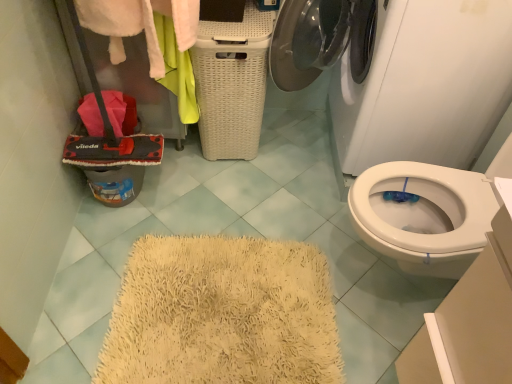
Question: Is white glossy washing machine at upper center bigger than white wicker basket at center?

Choices:
 (A) no
 (B) yes

Answer: (B)

Question: From the image's perspective, is white glossy washing machine at upper center on top of white wicker basket at center?

Choices:
 (A) yes
 (B) no

Answer: (A)

Question: Is white glossy washing machine at upper center located outside white wicker basket at center?

Choices:
 (A) no
 (B) yes

Answer: (B)

Question: Considering the relative sizes of white glossy washing machine at upper center and white wicker basket at center in the image provided, is white glossy washing machine at upper center wider than white wicker basket at center?

Choices:
 (A) yes
 (B) no

Answer: (A)

Question: Is white glossy washing machine at upper center in front of white wicker basket at center?

Choices:
 (A) yes
 (B) no

Answer: (A)

Question: Is white glossy washing machine at upper center far away from white wicker basket at center?

Choices:
 (A) yes
 (B) no

Answer: (B)

Question: From a real-world perspective, is white wicker basket at center beneath white fluffy towel at upper left?

Choices:
 (A) no
 (B) yes

Answer: (B)

Question: From the image's perspective, would you say white wicker basket at center is positioned over white fluffy towel at upper left?

Choices:
 (A) no
 (B) yes

Answer: (A)

Question: Is white wicker basket at center touching white fluffy towel at upper left?

Choices:
 (A) yes
 (B) no

Answer: (B)

Question: From a real-world perspective, is white wicker basket at center located higher than white fluffy towel at upper left?

Choices:
 (A) yes
 (B) no

Answer: (B)

Question: Is white wicker basket at center closer to camera compared to white fluffy towel at upper left?

Choices:
 (A) yes
 (B) no

Answer: (B)

Question: Is white wicker basket at center wider than white fluffy towel at upper left?

Choices:
 (A) no
 (B) yes

Answer: (B)

Question: Is white fluffy towel at upper left far away from white glossy washing machine at upper center?

Choices:
 (A) yes
 (B) no

Answer: (B)